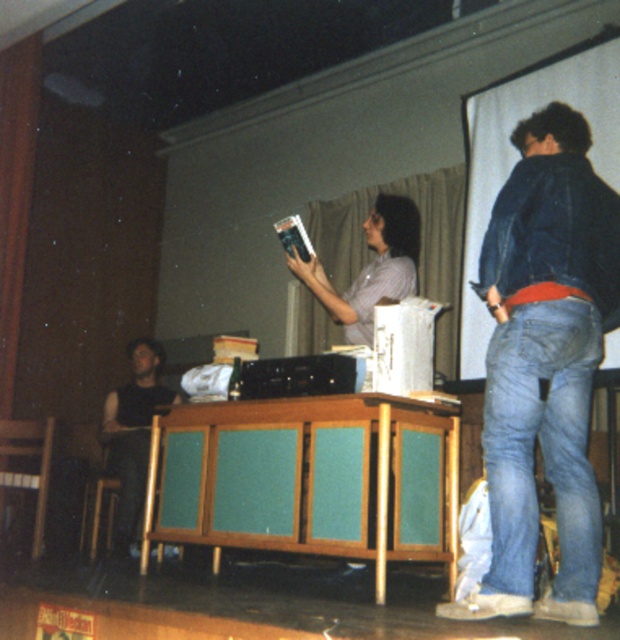
You are a stagehand who needs to move a 1.5 meter long ladder from the black sleeveless shirt at left to the green fabric curtain at upper center. Is there enough space to move the ladder without tilting it?

The distance between the green fabric curtain at upper center and the black sleeveless shirt at left is 1.51 meters. Since the ladder is 1.5 meters long, there is just enough space to move it without tilting.

You are standing in the classroom and want to move from the point at coordinates point [321,276] to the point at coordinates point [118,460]. Is the path between them clear?

Point [321,276] is in front of point [118,460], so the path between them is clear.

You are sitting at the table and want to reach both the green fabric curtain at upper center and the matte black book at center. Which object is closer to you?

The green fabric curtain at upper center is closer to you because it is further to the viewer than the matte black book at center.